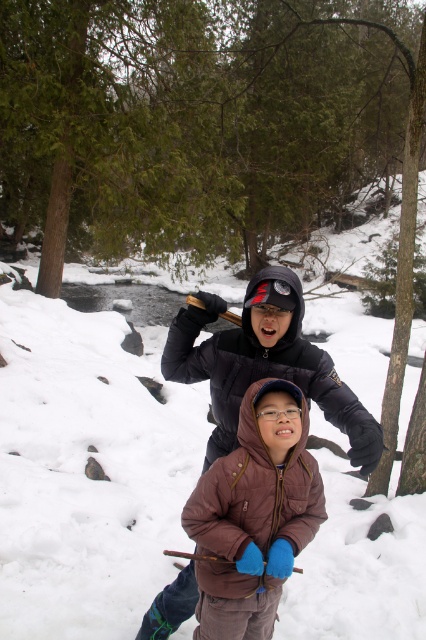
You are planning to build a snowman using the white fluffy snow at center and the brown leather jacket at center. Which object should you use for the base of the snowman?

The white fluffy snow at center is the appropriate material for building the snowman, as it is wider than the brown leather jacket at center and more suitable for forming the base.